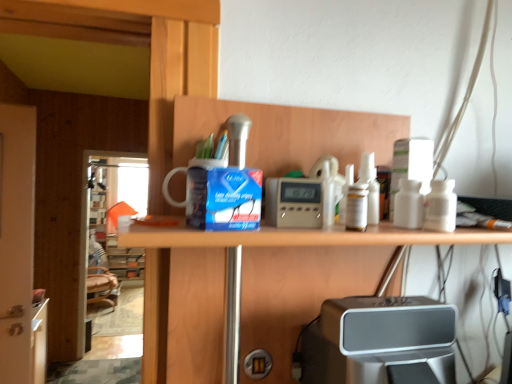
Find the location of a particular element. Image resolution: width=512 pixels, height=384 pixels. blank space above silver metallic speaker at lower center (from a real-world perspective) is located at coordinates (400, 357).